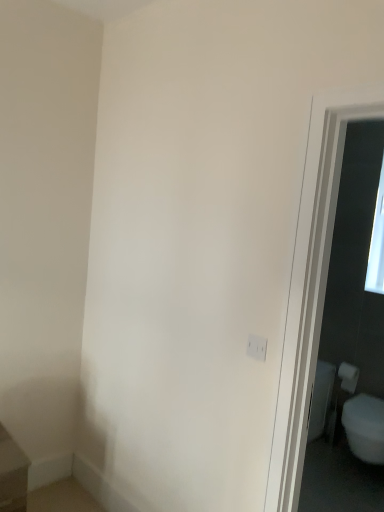
Question: From a real-world perspective, is white matte toilet paper at right positioned over white matte electric outlet at center-right based on gravity?

Choices:
 (A) yes
 (B) no

Answer: (B)

Question: From a real-world perspective, is white matte toilet paper at right located beneath white matte electric outlet at center-right?

Choices:
 (A) yes
 (B) no

Answer: (A)

Question: From the image's perspective, is white matte toilet paper at right located above white matte electric outlet at center-right?

Choices:
 (A) no
 (B) yes

Answer: (A)

Question: Does white matte toilet paper at right have a greater width compared to white matte electric outlet at center-right?

Choices:
 (A) yes
 (B) no

Answer: (A)

Question: Is white matte toilet paper at right aimed at white matte electric outlet at center-right?

Choices:
 (A) no
 (B) yes

Answer: (B)

Question: Would you say white matte toilet paper at right contains white matte electric outlet at center-right?

Choices:
 (A) yes
 (B) no

Answer: (B)

Question: From a real-world perspective, is white matte electric outlet at center-right over white matte toilet paper at right?

Choices:
 (A) no
 (B) yes

Answer: (B)

Question: Is white matte electric outlet at center-right not near white matte toilet paper at right?

Choices:
 (A) yes
 (B) no

Answer: (A)

Question: Can you confirm if white matte electric outlet at center-right is positioned to the right of white matte toilet paper at right?

Choices:
 (A) no
 (B) yes

Answer: (A)

Question: Is white matte electric outlet at center-right closer to camera compared to white matte toilet paper at right?

Choices:
 (A) no
 (B) yes

Answer: (B)

Question: From the image's perspective, is white matte electric outlet at center-right above white matte toilet paper at right?

Choices:
 (A) no
 (B) yes

Answer: (B)

Question: Is white matte electric outlet at center-right smaller than white matte toilet paper at right?

Choices:
 (A) yes
 (B) no

Answer: (A)

Question: Is white matte electric outlet at center-right taller or shorter than white matte toilet paper at right?

Choices:
 (A) tall
 (B) short

Answer: (B)